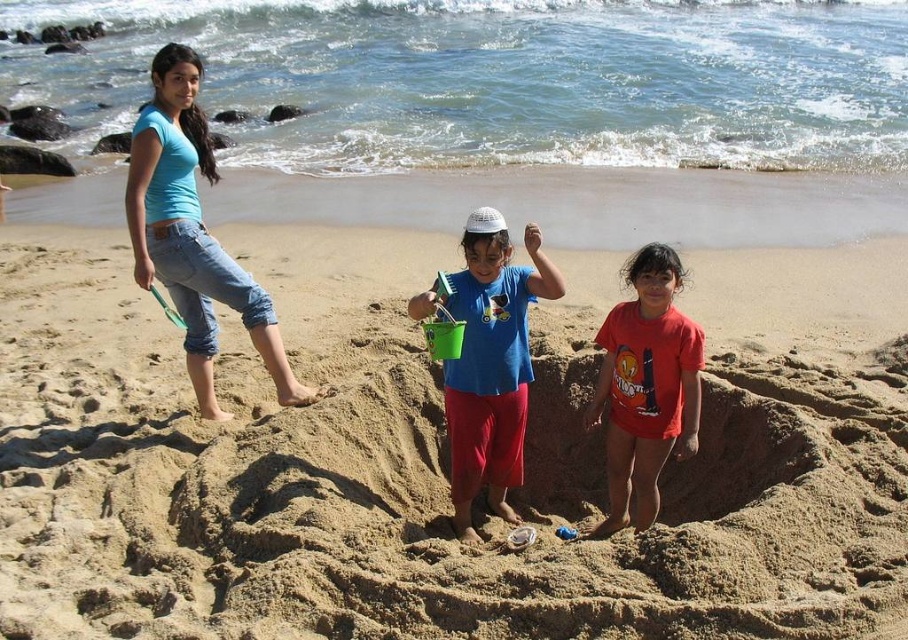
Which is in front, point (254, 337) or point (454, 301)?

Point (454, 301)

This screenshot has height=640, width=908. Describe the element at coordinates (192, 232) in the screenshot. I see `matte blue t-shirt at upper left` at that location.

Is point (147, 275) behind point (497, 470)?

Yes.

Locate an element on the screen. matte blue t-shirt at upper left is located at coordinates (192, 232).

Locate an element on the screen. matte blue t-shirt at upper left is located at coordinates (192, 232).

Is matte blue t-shirt at upper left bigger than red cotton shirt at center?

Yes, matte blue t-shirt at upper left is bigger than red cotton shirt at center.

Between point (168, 116) and point (677, 413), which one is positioned behind?

The point (168, 116) is more distant.

I want to click on matte blue t-shirt at upper left, so click(192, 232).

Which is below, beige sand at center or blue matte shirt at center?

Positioned lower is blue matte shirt at center.

Who is taller, beige sand at center or blue matte shirt at center?

beige sand at center is taller.

Between point (598, 556) and point (541, 266), which one is positioned behind?

Point (541, 266)

You are a GUI agent. You are given a task and a screenshot of the screen. Output one action in this format:
    pyautogui.click(x=<x>, y=<y>)
    Task: Click on the beige sand at center
    
    Given the screenshot: What is the action you would take?
    pyautogui.click(x=430, y=460)